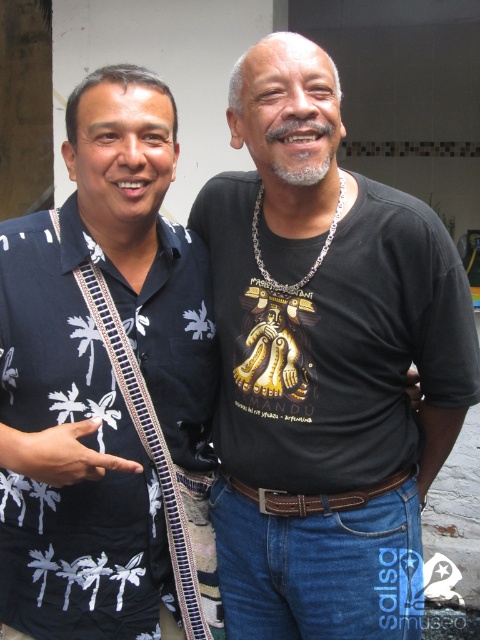
Question: In this image, where is white printed palm tree shirt at left located relative to brown leather belt at center?

Choices:
 (A) right
 (B) left

Answer: (B)

Question: Is white printed palm tree shirt at left thinner than brown leather belt at center?

Choices:
 (A) no
 (B) yes

Answer: (A)

Question: Is the position of white printed palm tree shirt at left less distant than that of brown leather belt at center?

Choices:
 (A) no
 (B) yes

Answer: (B)

Question: Which object is positioned closest to the white printed palm tree shirt at left?

Choices:
 (A) brown leather belt at center
 (B) black matte t-shirt at center

Answer: (B)

Question: Which object is closer to the camera taking this photo?

Choices:
 (A) brown leather belt at center
 (B) black matte t-shirt at center
 (C) white printed palm tree shirt at left

Answer: (C)

Question: Which of these objects is positioned closest to the black matte t-shirt at center?

Choices:
 (A) white printed palm tree shirt at left
 (B) brown leather belt at center

Answer: (A)